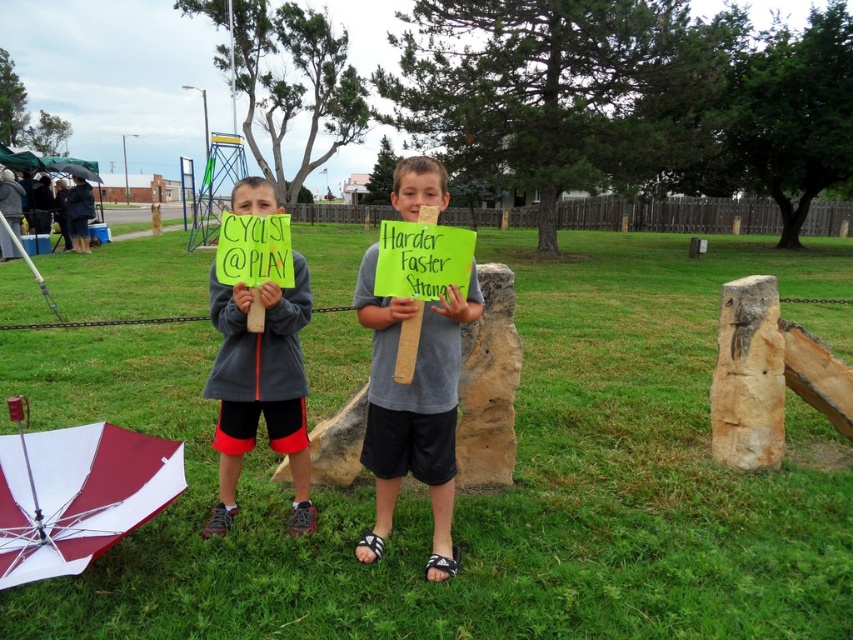
Which is more to the left, gray fabric shirt at center or maroon and white fabric umbrella at center?

From the viewer's perspective, maroon and white fabric umbrella at center appears more on the left side.

Who is taller, gray fabric shirt at center or maroon and white fabric umbrella at center?

Standing taller between the two is gray fabric shirt at center.

Identify the location of gray fabric shirt at center. The height and width of the screenshot is (640, 853). (413, 408).

Does point (582, 579) lie behind point (248, 422)?

No, it is not.

Who is positioned more to the left, green grass at center or gray fleece sweatshirt at center?

Positioned to the left is gray fleece sweatshirt at center.

Is point (552, 467) positioned in front of point (268, 316)?

No, it is not.

Where is `green grass at center`? This screenshot has width=853, height=640. green grass at center is located at coordinates (485, 490).

In the scene shown: Is green grass at center closer to camera compared to gray fabric shirt at center?

Yes, it is.

Is green grass at center below gray fabric shirt at center?

No.

Does point (683, 582) come in front of point (421, 401)?

No, it is behind (421, 401).

You are a GUI agent. You are given a task and a screenshot of the screen. Output one action in this format:
    pyautogui.click(x=<x>, y=<y>)
    Task: Click on the green grass at center
    
    Given the screenshot: What is the action you would take?
    pyautogui.click(x=485, y=490)